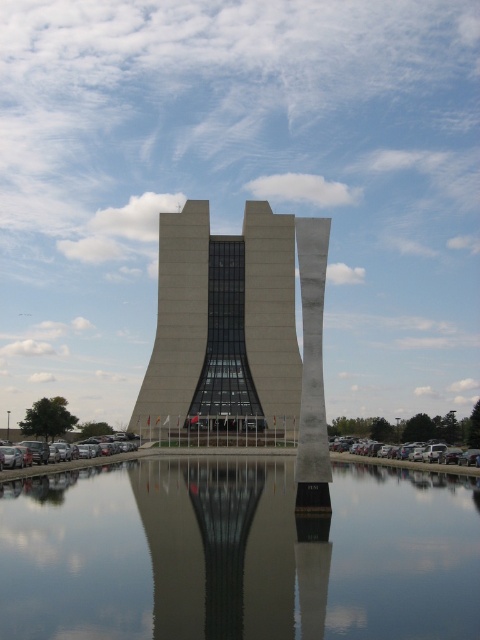
Question: Which is nearer to the gray concrete tower at center?

Choices:
 (A) silver metallic car at lower right
 (B) silver metallic car at lower left
 (C) clear glass water at center

Answer: (B)

Question: Can you confirm if clear glass water at center is positioned below gray concrete tower at center?

Choices:
 (A) no
 (B) yes

Answer: (B)

Question: Considering the real-world distances, which object is farthest from the silver metallic car at lower left?

Choices:
 (A) gray concrete tower at center
 (B) silver metallic car at lower right
 (C) clear glass water at center

Answer: (A)

Question: Is clear glass water at center below gray concrete tower at center?

Choices:
 (A) yes
 (B) no

Answer: (A)

Question: Estimate the real-world distances between objects in this image. Which object is farther from the silver metallic car at lower right?

Choices:
 (A) silver metallic car at lower left
 (B) gray concrete tower at center
 (C) clear glass water at center

Answer: (B)

Question: In this image, where is gray concrete tower at center located relative to silver metallic car at lower left?

Choices:
 (A) below
 (B) above

Answer: (B)